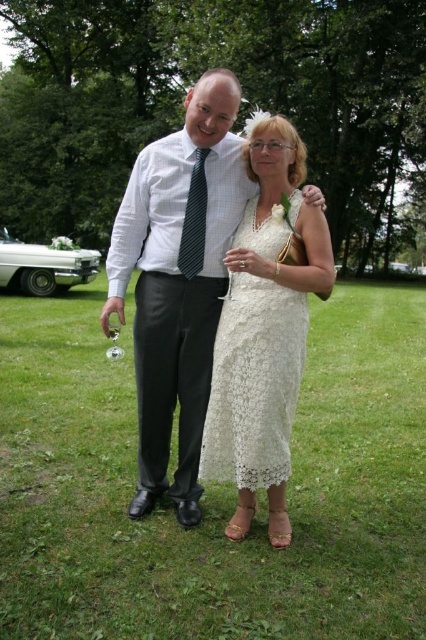
Which is more to the left, white lace dress at center or striped fabric tie at center?

From the viewer's perspective, striped fabric tie at center appears more on the left side.

Which is below, white lace dress at center or striped fabric tie at center?

white lace dress at center is lower down.

You are a GUI agent. You are given a task and a screenshot of the screen. Output one action in this format:
    pyautogui.click(x=<x>, y=<y>)
    Task: Click on the white lace dress at center
    The height and width of the screenshot is (640, 426).
    Given the screenshot: What is the action you would take?
    click(x=253, y=384)

Is point (221, 630) more distant than point (284, 472)?

No, it is in front of (284, 472).

Locate an element on the screen. This screenshot has height=640, width=426. green grass at center is located at coordinates (213, 488).

At what (x,y) coordinates should I click in order to perform the action: click on green grass at center. Please return your answer as a coordinate pair (x, y). This screenshot has width=426, height=640. Looking at the image, I should click on (213, 488).

This screenshot has height=640, width=426. What are the coordinates of `green grass at center` in the screenshot? It's located at [213, 488].

Does point (144, 461) come behind point (192, 250)?

Yes.

Is matte white shirt at center wider than striped fabric tie at center?

Yes.

Identify the location of matte white shirt at center. (176, 285).